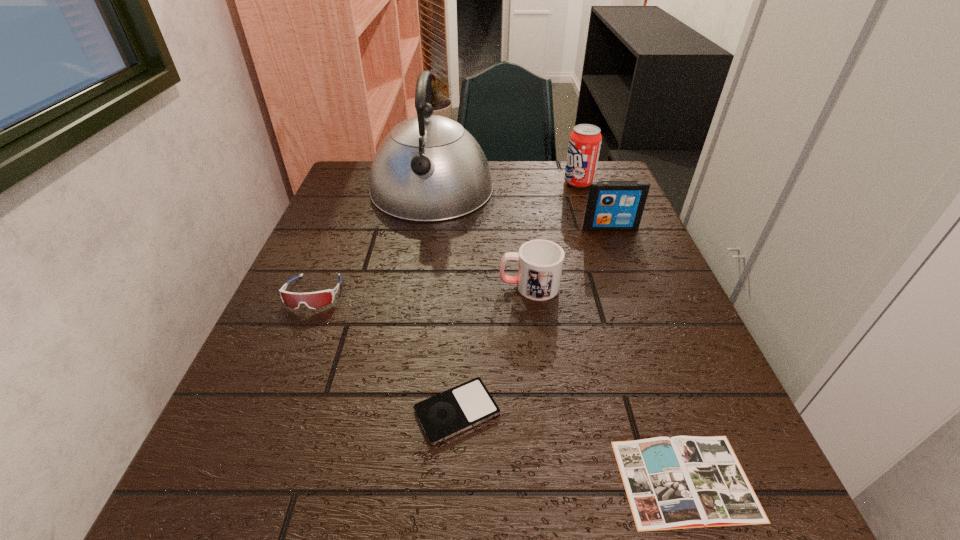
Locate an element on the screen. This screenshot has width=960, height=540. kettle is located at coordinates tap(428, 168).

At what (x,y) coordinates should I click in order to perform the action: click on the sixth shortest object. Please return your answer as a coordinate pair (x, y). The height and width of the screenshot is (540, 960). Looking at the image, I should click on (585, 140).

Identify the location of the right iPod. (612, 205).

This screenshot has height=540, width=960. What are the coordinates of `the farther iPod` in the screenshot? It's located at (612, 205).

Locate an element on the screen. The width and height of the screenshot is (960, 540). the fourth object from right to left is located at coordinates (540, 262).

Where is `mug`? Image resolution: width=960 pixels, height=540 pixels. mug is located at coordinates [x=540, y=262].

Identify the location of the third shortest object. The width and height of the screenshot is (960, 540). (314, 300).

The width and height of the screenshot is (960, 540). I want to click on the nearer iPod, so click(x=442, y=416).

The height and width of the screenshot is (540, 960). In order to click on the left iPod in this screenshot , I will do click(x=442, y=416).

Locate an element on the screen. The image size is (960, 540). book is located at coordinates (681, 482).